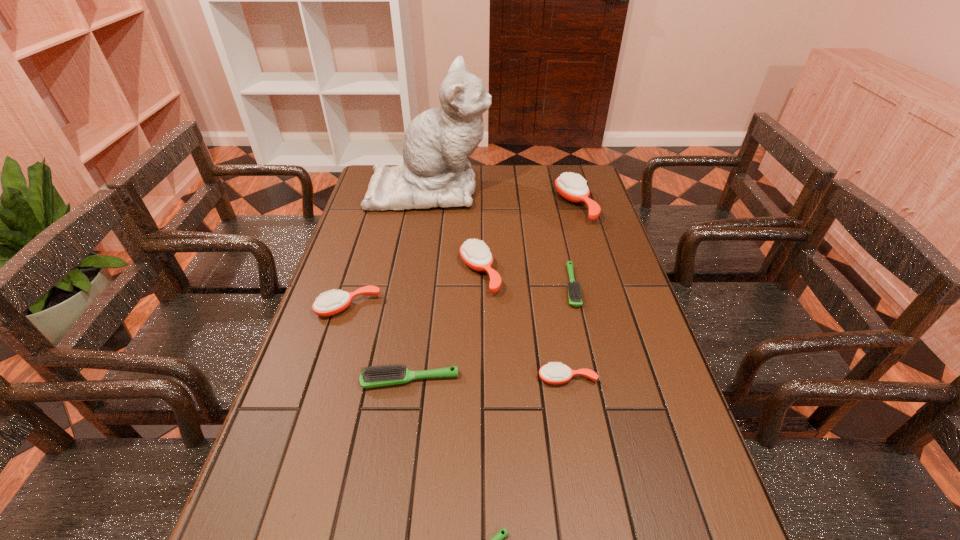
Where is `vacant region between the second smallest light hairbrush and the second tallest hairbrush`? The image size is (960, 540). vacant region between the second smallest light hairbrush and the second tallest hairbrush is located at coordinates (525, 280).

Where is `free space between the third smallest orange hairbrush and the second smallest light hairbrush`? free space between the third smallest orange hairbrush and the second smallest light hairbrush is located at coordinates (525, 280).

Where is `vacant area between the tallest object and the second smallest light hairbrush`? This screenshot has height=540, width=960. vacant area between the tallest object and the second smallest light hairbrush is located at coordinates (500, 238).

Identify the location of free space between the smallest orange hairbrush and the leftmost orange hairbrush. The height and width of the screenshot is (540, 960). (458, 342).

The image size is (960, 540). In order to click on empty space between the biggest light hairbrush and the third tallest hairbrush in this screenshot , I will do `click(379, 343)`.

Where is `free point between the third orange hairbrush from right to left and the farthest hairbrush`? This screenshot has width=960, height=540. free point between the third orange hairbrush from right to left and the farthest hairbrush is located at coordinates (527, 239).

The width and height of the screenshot is (960, 540). What are the coordinates of `object that can be found as the sixth closest to the fifth shortest hairbrush` in the screenshot? It's located at (497, 539).

Select which object appears as the sixth closest to the seventh tallest object. Please provide its 2D coordinates. Your answer should be formatted as a tuple, i.e. [(x, y)], where the tuple contains the x and y coordinates of a point satisfying the conditions above.

[(329, 304)]

Select which hairbrush appears as the second closest to the sixth shortest hairbrush. Please provide its 2D coordinates. Your answer should be formatted as a tuple, i.e. [(x, y)], where the tuple contains the x and y coordinates of a point satisfying the conditions above.

[(329, 304)]

You are a GUI agent. You are given a task and a screenshot of the screen. Output one action in this format:
    pyautogui.click(x=<x>, y=<y>)
    Task: Click on the hairbrush that stands as the closest to the biggest orange hairbrush
    This screenshot has height=540, width=960.
    Given the screenshot: What is the action you would take?
    pyautogui.click(x=574, y=291)